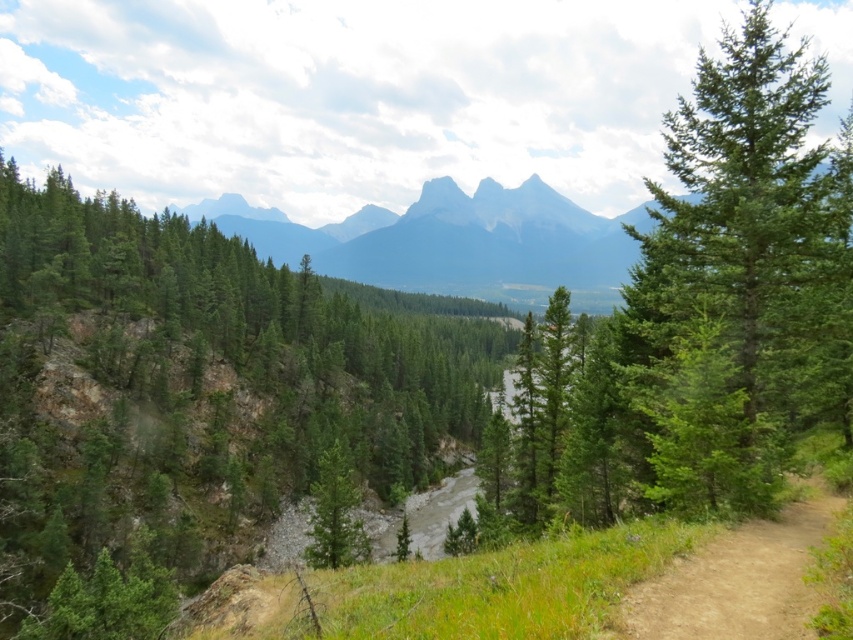
You are a hiker planning to walk along the brown dirt track at lower right. You notice a green evergreen tree at right nearby. Which one is larger in size?

The green evergreen tree at right is bigger than the brown dirt track at lower right.

You are a hiker standing at the lower left corner of the image, planning to hike along the brown dirt track at lower right. You want to know if the green evergreen tree at right is blocking your path. Can you determine this based on the scene?

The green evergreen tree at right is further to the viewer than the brown dirt track at lower right, so it is positioned in front of the track. This means the green evergreen tree at right is blocking the path along the brown dirt track at lower right.

You are a hiker planning to take a photo of the gray rocky mountain at center from the point marked at coordinate point [454,243]. Is the gray rocky mountain at center visible from that point?

The point marked at coordinate point [454,243] is where the gray rocky mountain at center is located, so you are standing on the mountain itself. Therefore, you would not be able to see the mountain from that point as you are already on it.